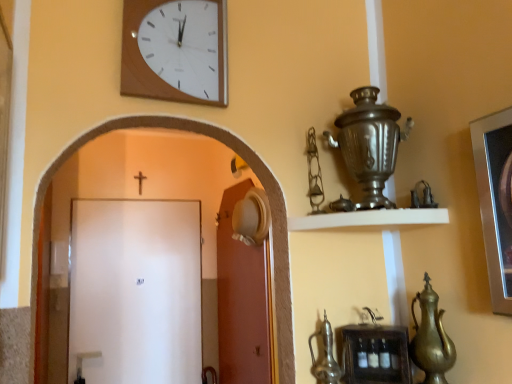
Question: Is black wooden crucifix at upper center positioned beyond the bounds of gold metallic teapot at lower right, which appears as the second tea pot when viewed from the left?

Choices:
 (A) no
 (B) yes

Answer: (B)

Question: Is black wooden crucifix at upper center bigger than gold metallic teapot at lower right, which appears as the second tea pot when viewed from the left?

Choices:
 (A) no
 (B) yes

Answer: (A)

Question: From a real-world perspective, is black wooden crucifix at upper center over gold metallic teapot at lower right, which appears as the second tea pot when viewed from the left?

Choices:
 (A) yes
 (B) no

Answer: (A)

Question: Does black wooden crucifix at upper center appear on the left side of gold metallic teapot at lower right, which appears as the second tea pot when viewed from the left?

Choices:
 (A) no
 (B) yes

Answer: (B)

Question: Are black wooden crucifix at upper center and gold metallic teapot at lower right, which appears as the second tea pot when viewed from the left, located far from each other?

Choices:
 (A) yes
 (B) no

Answer: (A)

Question: Considering the positions of white matte door at center, the 1th door positioned from the left, and gold metallic teapot at lower right, which appears as the second tea pot when viewed from the left, in the image, is white matte door at center, the 1th door positioned from the left, taller or shorter than gold metallic teapot at lower right, which appears as the second tea pot when viewed from the left,?

Choices:
 (A) tall
 (B) short

Answer: (A)

Question: Is point (136, 317) closer or farther from the camera than point (424, 367)?

Choices:
 (A) farther
 (B) closer

Answer: (A)

Question: Based on their sizes in the image, would you say white matte door at center, which ranks as the second door in right-to-left order, is bigger or smaller than gold metallic teapot at lower right, which appears as the second tea pot when viewed from the left?

Choices:
 (A) big
 (B) small

Answer: (A)

Question: From a real-world perspective, is white matte door at center, the 1th door positioned from the left, above or below gold metallic teapot at lower right, marked as the first tea pot in a right-to-left arrangement?

Choices:
 (A) below
 (B) above

Answer: (B)

Question: Is metallic silver teapot at lower center, placed as the 1th tea pot when sorted from left to right, spatially inside white matte shelf at upper center, arranged as the second shelf when ordered from the bottom, or outside of it?

Choices:
 (A) outside
 (B) inside

Answer: (A)

Question: Visually, is metallic silver teapot at lower center, placed as the second tea pot when sorted from right to left, positioned to the left or to the right of white matte shelf at upper center, arranged as the second shelf when ordered from the bottom?

Choices:
 (A) left
 (B) right

Answer: (A)

Question: Considering the positions of metallic silver teapot at lower center, placed as the second tea pot when sorted from right to left, and white matte shelf at upper center, the first shelf positioned from the top, in the image, is metallic silver teapot at lower center, placed as the second tea pot when sorted from right to left, bigger or smaller than white matte shelf at upper center, the first shelf positioned from the top,?

Choices:
 (A) small
 (B) big

Answer: (A)

Question: Is metallic silver teapot at lower center, placed as the second tea pot when sorted from right to left, in front of or behind white matte shelf at upper center, arranged as the second shelf when ordered from the bottom, in the image?

Choices:
 (A) front
 (B) behind

Answer: (B)

Question: Is point (412, 302) closer or farther from the camera than point (222, 251)?

Choices:
 (A) farther
 (B) closer

Answer: (B)

Question: Do you think gold metallic teapot at lower right, which appears as the second tea pot when viewed from the left, is within white matte door at center, which is the second door from left to right, or outside of it?

Choices:
 (A) outside
 (B) inside

Answer: (A)